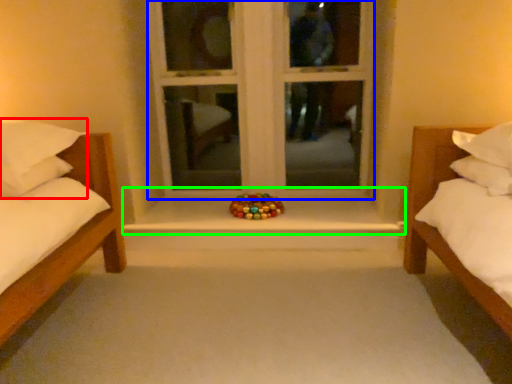
Question: Which object is the closest to the pillow (highlighted by a red box)? Choose among these: window frame (highlighted by a blue box) or window sill (highlighted by a green box).

Choices:
 (A) window frame
 (B) window sill

Answer: (B)